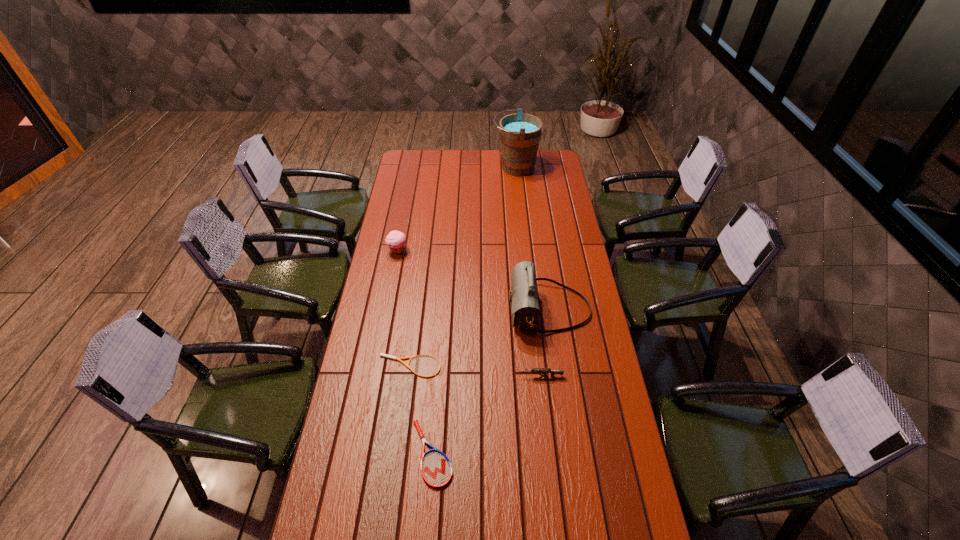
You are a GUI agent. You are given a task and a screenshot of the screen. Output one action in this format:
    pyautogui.click(x=<x>, y=<y>)
    Task: Click on the free space located with a handle on the side of the tallest object
    The image size is (960, 540).
    Given the screenshot: What is the action you would take?
    click(455, 167)

The width and height of the screenshot is (960, 540). I want to click on blank space located 0.340m with a handle on the side of the tallest object, so click(432, 167).

Image resolution: width=960 pixels, height=540 pixels. I want to click on free region located 0.070m on the front of the fifth shortest object, so click(x=555, y=354).

Where is `vacant space located 0.160m on the front of the second farthest object`? This screenshot has height=540, width=960. vacant space located 0.160m on the front of the second farthest object is located at coordinates (392, 284).

At what (x,y) coordinates should I click in order to perform the action: click on free space located aimed along the barrel of the third shortest object. Please return your answer as a coordinate pair (x, y). Looking at the image, I should click on (421, 376).

The width and height of the screenshot is (960, 540). What are the coordinates of `free space located 0.360m aimed along the barrel of the third shortest object` in the screenshot? It's located at (419, 376).

The width and height of the screenshot is (960, 540). What are the coordinates of `free location located 0.310m aimed along the barrel of the third shortest object` in the screenshot? It's located at (432, 376).

The height and width of the screenshot is (540, 960). Identify the location of vacant space located on the back of the nearest object. (436, 402).

I want to click on free spot located on the front of the farther tennis racket, so click(404, 414).

Locate an element on the screen. Image resolution: width=960 pixels, height=540 pixels. object situated at the far edge is located at coordinates (519, 133).